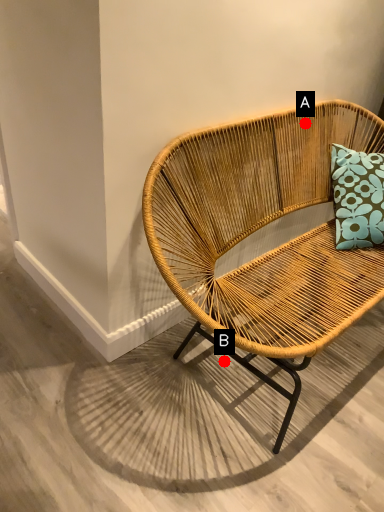
Question: Two points are circled on the image, labeled by A and B beside each circle. Among these points, which one is nearest to the camera?

Choices:
 (A) A is closer
 (B) B is closer

Answer: (B)